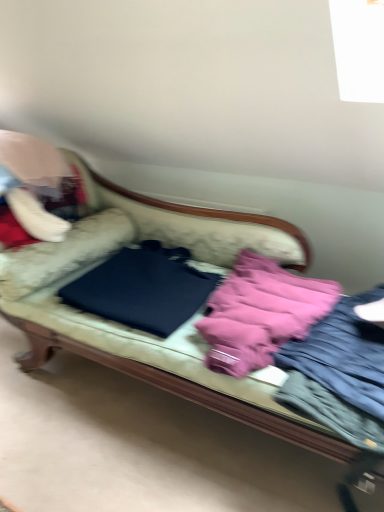
Question: Is black matte laptop at center shorter than pink fabric jacket at right?

Choices:
 (A) yes
 (B) no

Answer: (B)

Question: Does black matte laptop at center have a lesser width compared to pink fabric jacket at right?

Choices:
 (A) yes
 (B) no

Answer: (A)

Question: From a real-world perspective, is black matte laptop at center located higher than pink fabric jacket at right?

Choices:
 (A) yes
 (B) no

Answer: (A)

Question: Is pink fabric jacket at right a part of black matte laptop at center?

Choices:
 (A) yes
 (B) no

Answer: (B)

Question: Does black matte laptop at center appear on the left side of pink fabric jacket at right?

Choices:
 (A) yes
 (B) no

Answer: (A)

Question: Is velvet fabric couch at center inside or outside of black matte laptop at center?

Choices:
 (A) inside
 (B) outside

Answer: (B)

Question: Is velvet fabric couch at center taller or shorter than black matte laptop at center?

Choices:
 (A) short
 (B) tall

Answer: (B)

Question: In terms of width, does velvet fabric couch at center look wider or thinner when compared to black matte laptop at center?

Choices:
 (A) wide
 (B) thin

Answer: (A)

Question: Looking at the image, does velvet fabric couch at center seem bigger or smaller compared to black matte laptop at center?

Choices:
 (A) big
 (B) small

Answer: (A)

Question: Considering the positions of velvet fabric couch at center and pink fabric at center in the image, is velvet fabric couch at center bigger or smaller than pink fabric at center?

Choices:
 (A) big
 (B) small

Answer: (A)

Question: Would you say velvet fabric couch at center is inside or outside pink fabric at center?

Choices:
 (A) outside
 (B) inside

Answer: (A)

Question: From a real-world perspective, is velvet fabric couch at center physically located above or below pink fabric at center?

Choices:
 (A) above
 (B) below

Answer: (B)

Question: Visually, is velvet fabric couch at center positioned to the left or to the right of pink fabric at center?

Choices:
 (A) left
 (B) right

Answer: (A)

Question: From a real-world perspective, is velvet fabric couch at center above or below pink fabric jacket at right?

Choices:
 (A) below
 (B) above

Answer: (A)

Question: From the image's perspective, is velvet fabric couch at center located above or below pink fabric jacket at right?

Choices:
 (A) above
 (B) below

Answer: (A)